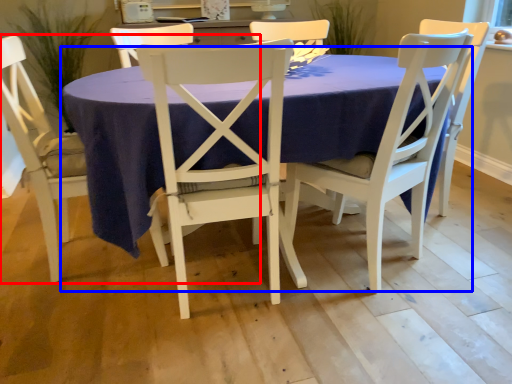
Question: Which object appears closest to the camera in this image, chair (highlighted by a red box) or kitchen & dining room table (highlighted by a blue box)?

Choices:
 (A) chair
 (B) kitchen & dining room table

Answer: (B)